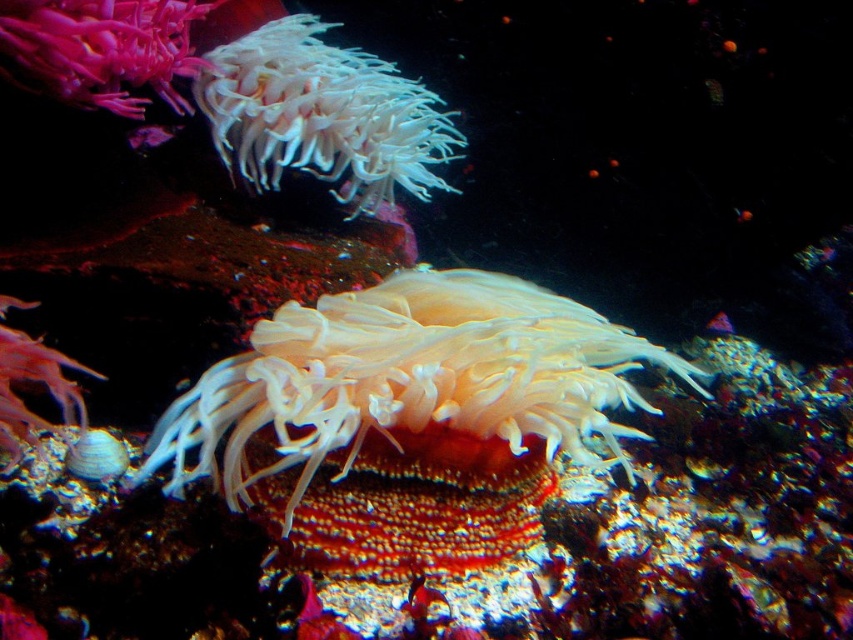
You are a marine biologist observing an underwater scene. You notice a white soft coral at upper center and a smooth pink coral at upper left. Which coral is positioned to the right side of the other?

The white soft coral at upper center is positioned to the right of the smooth pink coral at upper left.

You are a marine biologist studying underwater life. You need to locate the translucent white anemone at center in the image. According to the coordinates provided, where would you find it?

The translucent white anemone at center is located at coordinates point (410, 380).

You are a marine biologist studying underwater organisms. You observe the translucent white anemone at center and the white soft coral at upper center. Based on their positions, which one is located to the right of the other?

The translucent white anemone at center is to the right of the white soft coral at upper center.